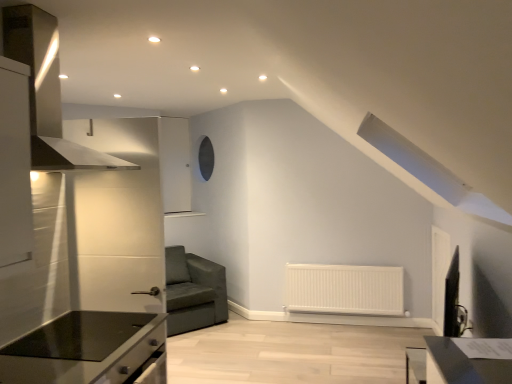
Question: From the image's perspective, is black glass countertop at lower left located above or below stainless steel exhaust hood at left?

Choices:
 (A) above
 (B) below

Answer: (B)

Question: In terms of width, does black glass countertop at lower left look wider or thinner when compared to stainless steel exhaust hood at left?

Choices:
 (A) wide
 (B) thin

Answer: (A)

Question: Which of these objects is positioned closest to the stainless steel exhaust hood at left?

Choices:
 (A) white matte radiator at lower center
 (B) black glass countertop at lower left
 (C) dark gray fabric couch at lower left

Answer: (B)

Question: Estimate the real-world distances between objects in this image. Which object is farther from the dark gray fabric couch at lower left?

Choices:
 (A) black glass countertop at lower left
 (B) white matte radiator at lower center
 (C) stainless steel exhaust hood at left

Answer: (C)